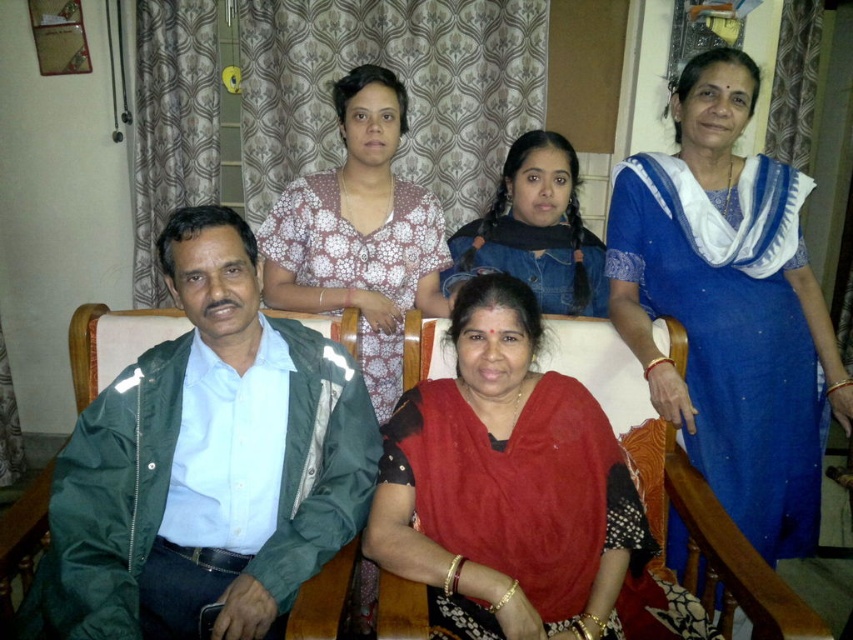
Question: Is white dotted blouse at upper center above denim jacket at center?

Choices:
 (A) yes
 (B) no

Answer: (B)

Question: Which of these objects is positioned closest to the blue silk saree at upper right?

Choices:
 (A) green fabric jacket at left
 (B) red silk saree at center

Answer: (B)

Question: From the image, what is the correct spatial relationship of blue silk saree at upper right in relation to red silk saree at center?

Choices:
 (A) right
 (B) left

Answer: (A)

Question: Among these points, which one is farthest from the camera?

Choices:
 (A) (525, 448)
 (B) (82, 554)
 (C) (372, 323)
 (D) (585, 241)

Answer: (D)

Question: Which of the following is the farthest from the observer?

Choices:
 (A) 225,376
 (B) 763,528
 (C) 363,289
 (D) 479,388

Answer: (C)

Question: Is green fabric jacket at left thinner than white dotted blouse at upper center?

Choices:
 (A) no
 (B) yes

Answer: (A)